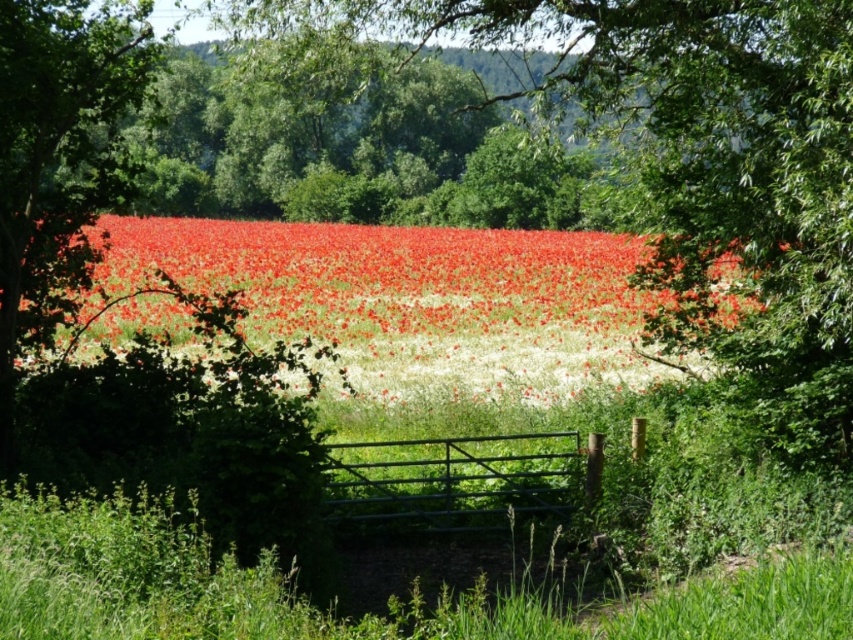
You are standing at the entrance of the dark green metal gate in the center of the image. Looking towards the field, you see a green leafy tree at center and bright red petals at center. Which object is higher in the scene?

The green leafy tree at center is above the bright red petals at center, so the green leafy tree at center is higher in the scene.

You are standing at the entrance of the dark green metal gate in the center. Which direction should you walk to reach the green leafy tree at center?

The green leafy tree at center is located at point coordinates of (693, 166). Since you are at the entrance of the dark green metal gate in the center, you should walk towards the direction of the coordinates (693, 166) to reach the green leafy tree at center.

You are standing in front of the dark green metal gate in the rural landscape. You notice a green leafy tree at center and bright red petals at center. Which object is closer to you?

The green leafy tree at center is closer to the viewer than the bright red petals at center.